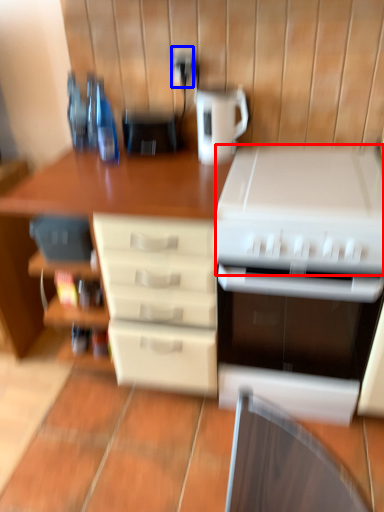
Question: Which object is further to the camera taking this photo, appliance (highlighted by a red box) or electric outlet (highlighted by a blue box)?

Choices:
 (A) appliance
 (B) electric outlet

Answer: (B)